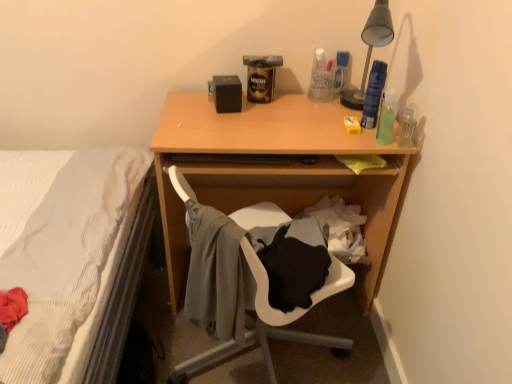
Identify the location of free space that is to the left of translucent plastic spray can at upper right, marked as the 3th bottle in a front-to-back arrangement. (324, 120).